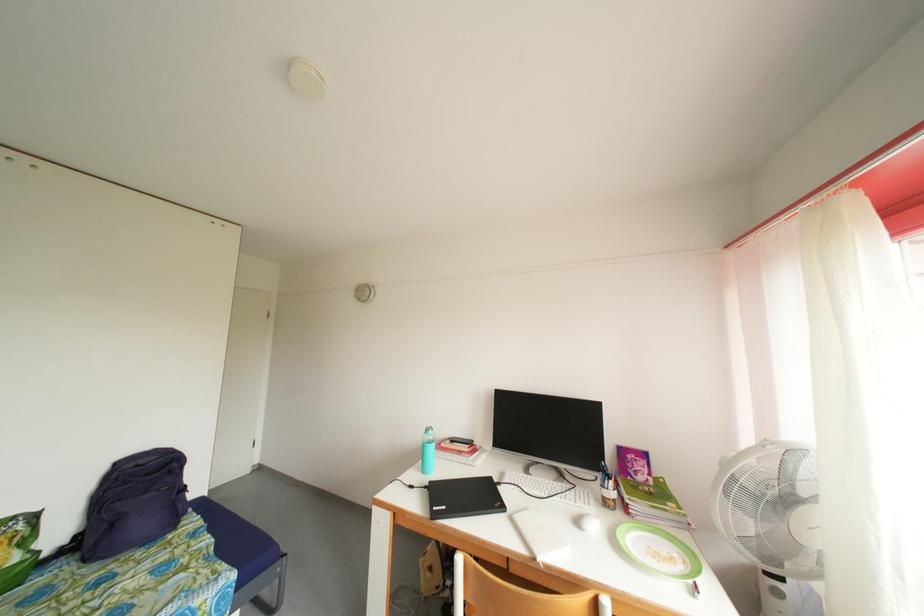
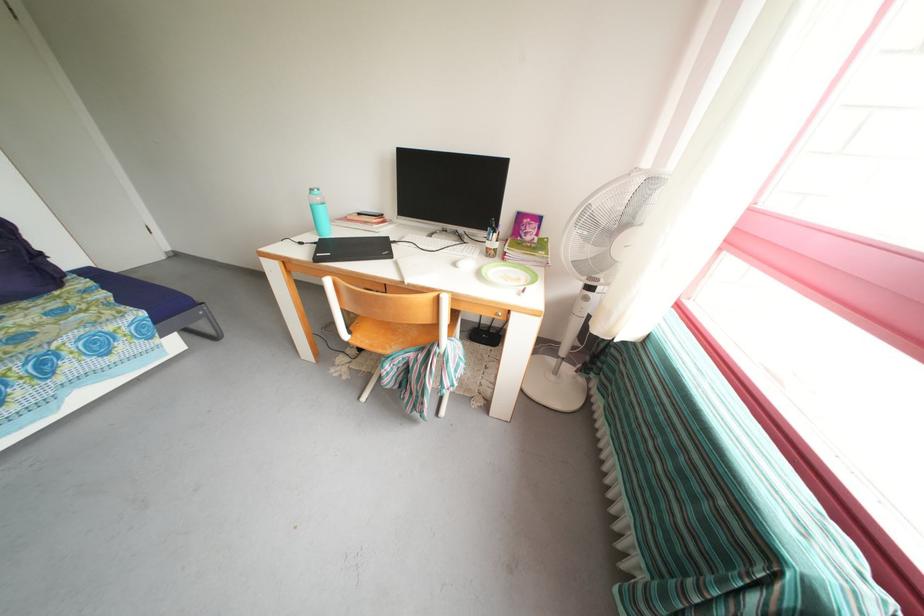
Question: How did the camera likely rotate?

Choices:
 (A) Left
 (B) Right
 (C) Up
 (D) Down

Answer: (D)